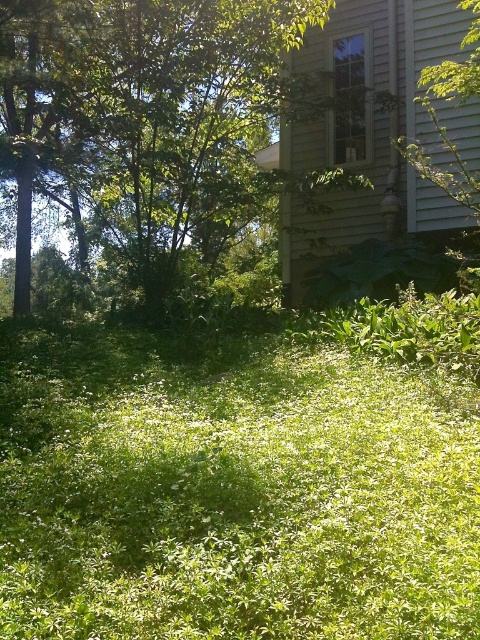
You are standing in the grassy area with sunlight and shadow. You see two points marked in the scene. Which point is closer to you, point (372,632) or point (243,4)?

Point (372,632) is in front of point (243,4), so it is closer to you.

Based on the photo, you are a gardener who wants to plant a new flower bed. You notice the green leafy grass at center and the green leafy tree at upper center. Which object is taller and would require more space in the garden?

The green leafy grass at center is much taller than the green leafy tree at upper center, so it would require more space in the garden.